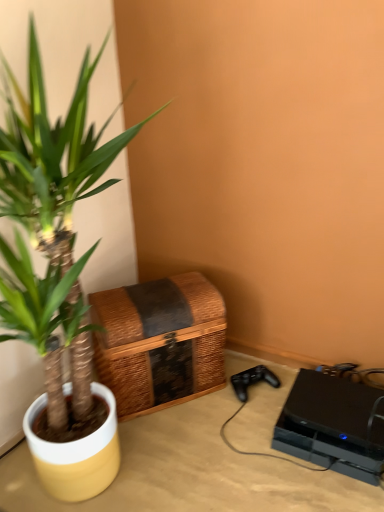
Image resolution: width=384 pixels, height=512 pixels. Find the location of `vacant space underneath green leafy plant at left (from a real-world perspective)`. vacant space underneath green leafy plant at left (from a real-world perspective) is located at coordinates (110, 489).